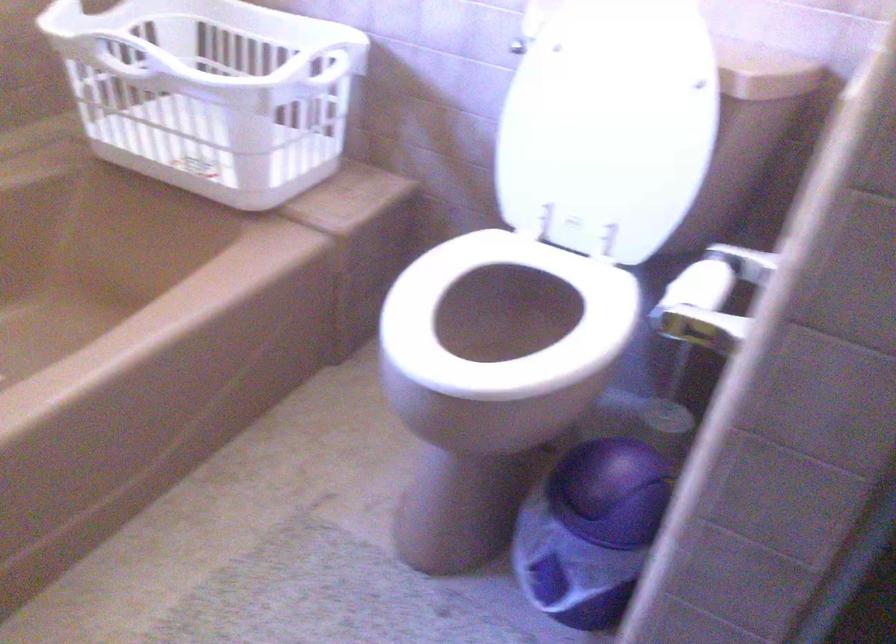
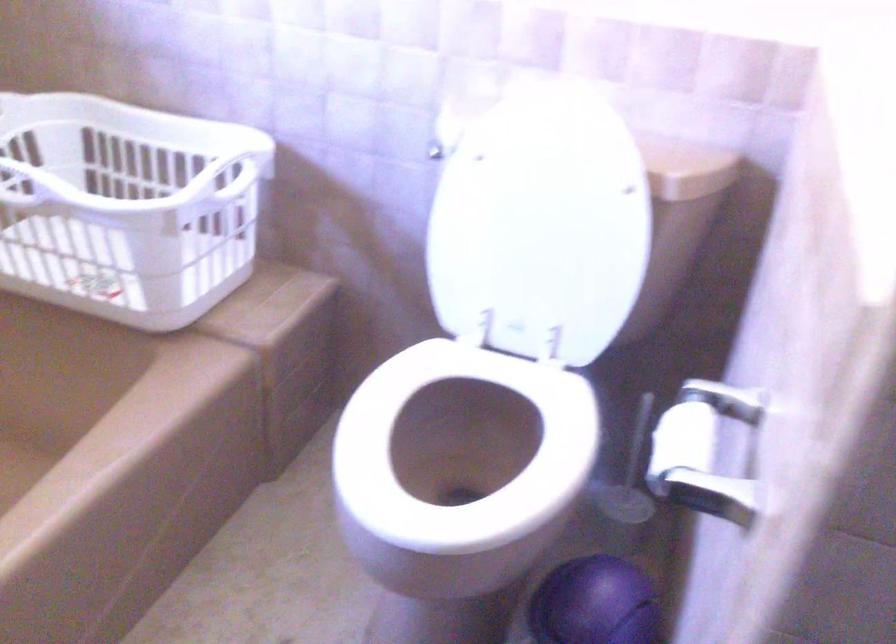
Where in the second image is the point corresponding to point 316,73 from the first image?

(222, 178)